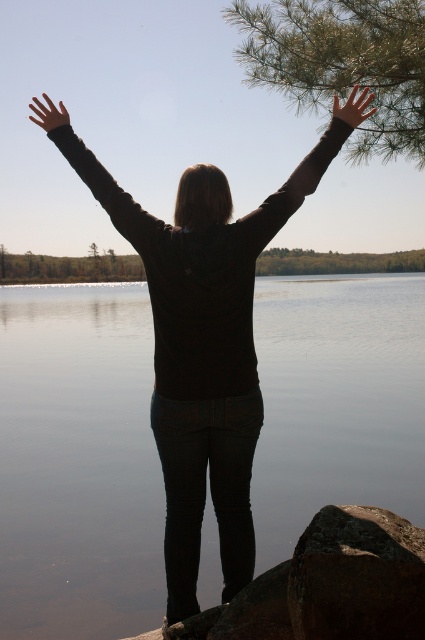
Question: Which object is the closest to the matte black arm at upper center?

Choices:
 (A) rough textured rock at lower right
 (B) green textured pine branch at upper center
 (C) black matte arm at upper center
 (D) matte black hand at upper right

Answer: (D)

Question: Which object is positioned closest to the black matte hand at upper left?

Choices:
 (A) rough textured rock at lower right
 (B) green textured pine branch at upper center

Answer: (A)

Question: Is green textured pine branch at upper center positioned before rough textured rock at lower right?

Choices:
 (A) yes
 (B) no

Answer: (B)

Question: Does black matte arm at upper center appear on the left side of black matte hand at upper left?

Choices:
 (A) yes
 (B) no

Answer: (B)

Question: Which object is closer to the camera taking this photo?

Choices:
 (A) matte black arm at upper center
 (B) rough textured rock at lower right
 (C) black matte arm at upper center
 (D) green textured pine branch at upper center

Answer: (B)

Question: Can you confirm if transparent water at center is wider than black matte hand at upper left?

Choices:
 (A) yes
 (B) no

Answer: (A)